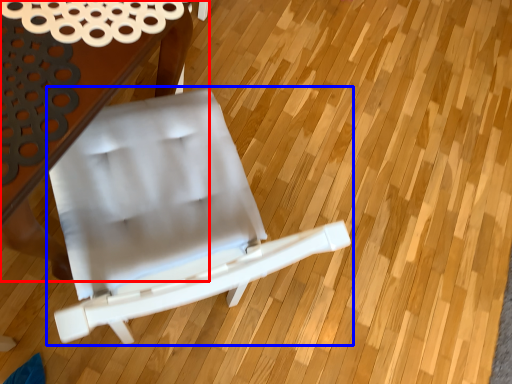
Question: Which of the following is the closest to the observer, table (highlighted by a red box) or chair (highlighted by a blue box)?

Choices:
 (A) table
 (B) chair

Answer: (B)